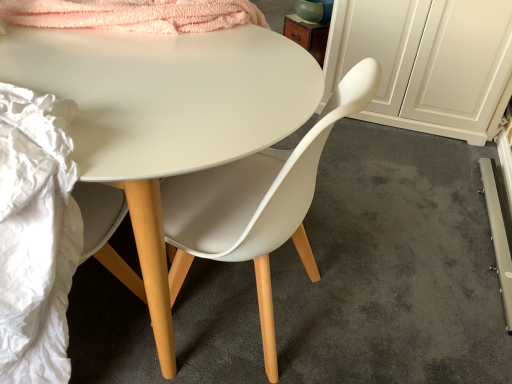
Where is `vacant region to the right of matte white chair at center`? This screenshot has width=512, height=384. vacant region to the right of matte white chair at center is located at coordinates (379, 304).